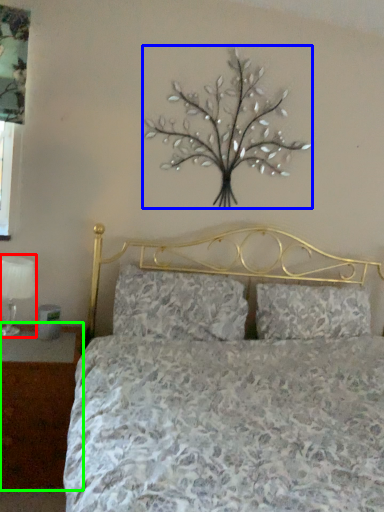
Question: Which object is positioned farthest from table lamp (highlighted by a red box)? Select from flower (highlighted by a blue box) and nightstand (highlighted by a green box).

Choices:
 (A) flower
 (B) nightstand

Answer: (A)